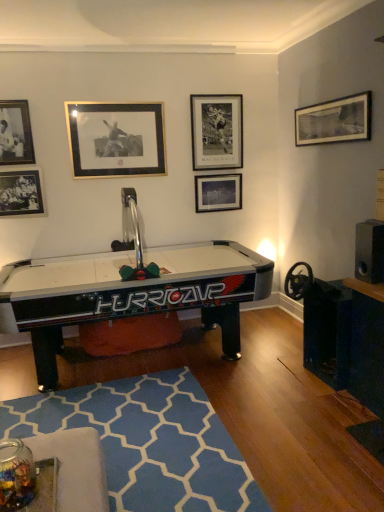
Locate an element on the screen. The height and width of the screenshot is (512, 384). free space above matte black picture frame at upper right, arranged as the sixth picture frame when viewed from the left (from a real-world perspective) is located at coordinates (330, 100).